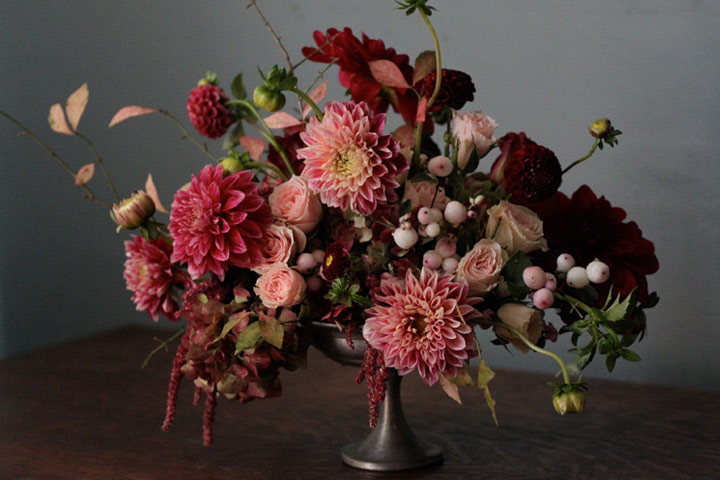
Locate an element on the screen. Image resolution: width=720 pixels, height=480 pixels. tabletop is located at coordinates (518, 455).